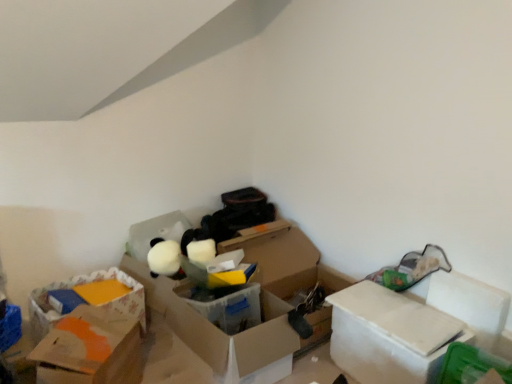
Question: In terms of width, does orange cardboard box at lower left, positioned as the third box in right-to-left order, look wider or thinner when compared to green plastic storage box at lower right, which is the first storage box in front-to-back order?

Choices:
 (A) wide
 (B) thin

Answer: (A)

Question: From a real-world perspective, is orange cardboard box at lower left, positioned as the third box in right-to-left order, positioned above or below green plastic storage box at lower right, the 1th storage box when ordered from right to left?

Choices:
 (A) above
 (B) below

Answer: (B)

Question: Which object is positioned closest to the white cardboard box at right, the third box in the left-to-right sequence?

Choices:
 (A) translucent plastic box at center, which ranks as the second box in left-to-right order
 (B) cardboard box at left, which is counted as the 1th storage box, starting from the left
 (C) green plastic storage box at lower right, the 1th storage box when ordered from right to left
 (D) orange cardboard box at lower left, positioned as the third box in right-to-left order

Answer: (C)

Question: Based on their relative distances, which object is nearer to the cardboard box at left, acting as the second storage box starting from the right?

Choices:
 (A) orange cardboard box at lower left, positioned as the third box in right-to-left order
 (B) translucent plastic box at center, the second box positioned from the right
 (C) green plastic storage box at lower right, the 1th storage box when ordered from right to left
 (D) white cardboard box at right, the third box in the left-to-right sequence

Answer: (A)